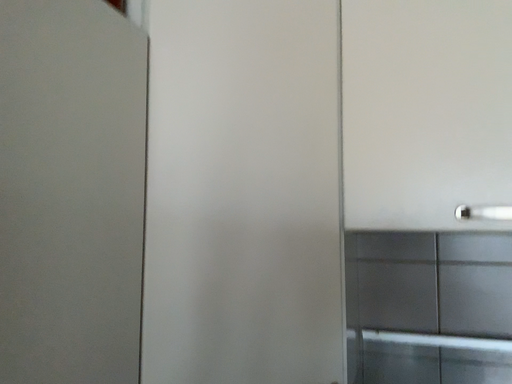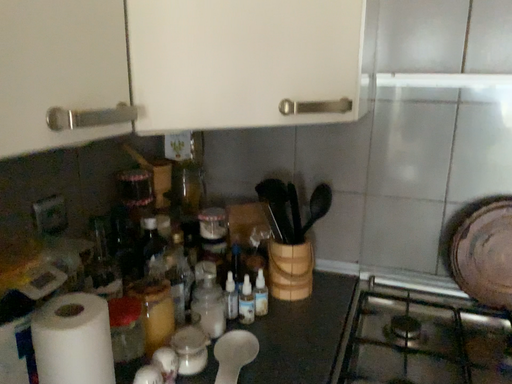
Question: How did the camera likely rotate when shooting the video?

Choices:
 (A) rotated upward
 (B) rotated downward

Answer: (B)